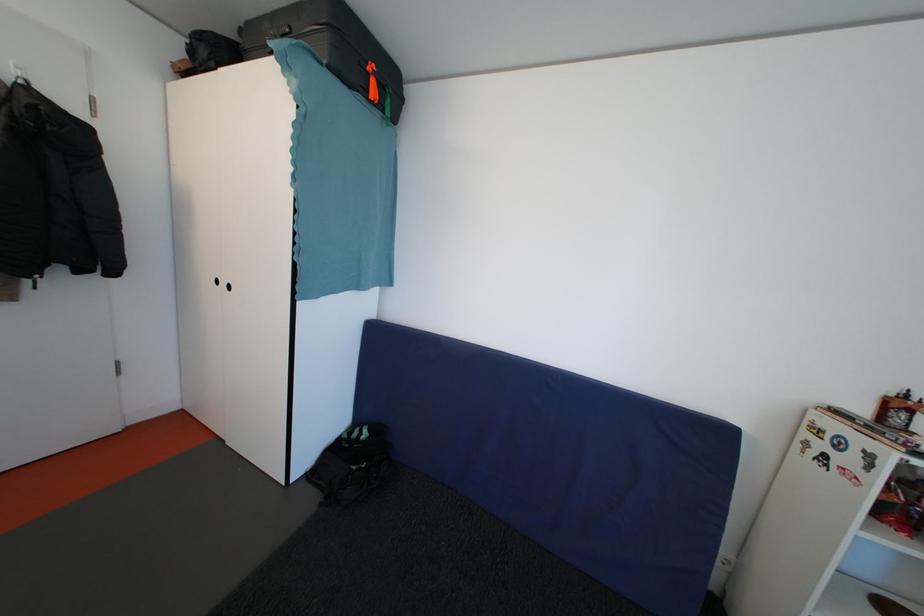
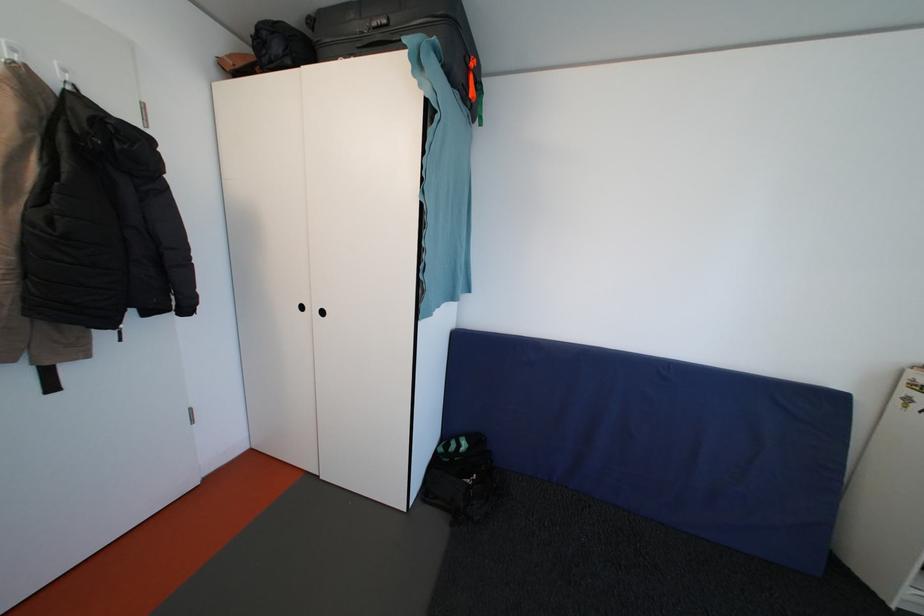
Where in the second image is the point corresponding to (x=362, y=477) from the first image?

(480, 490)